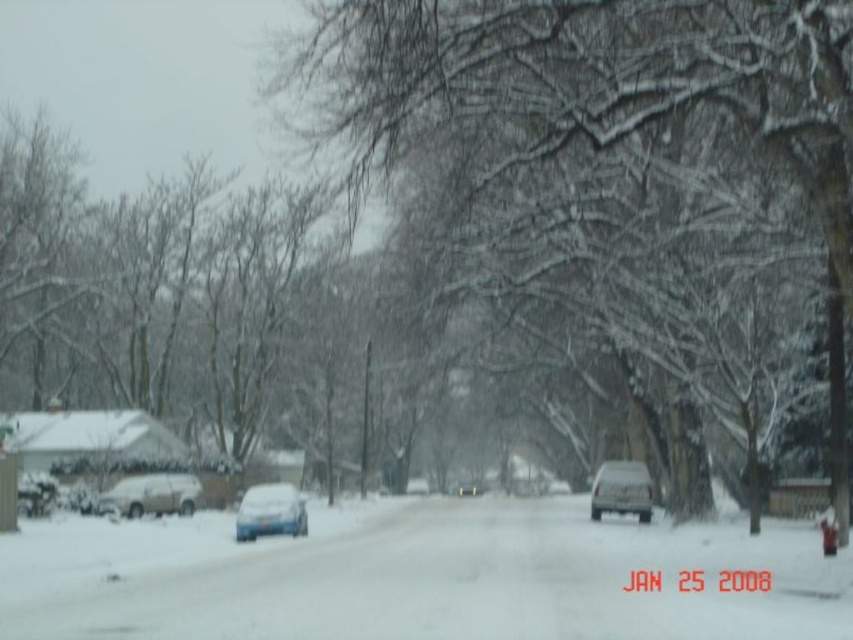
Between white matte suv at left and matte blue car at center, which one appears on the left side from the viewer's perspective?

white matte suv at left is more to the left.

Who is more forward, [170,508] or [262,506]?

Point [262,506] is more forward.

Identify the location of white matte suv at left. (151, 496).

Which is behind, point (469, 570) or point (590, 516)?

Positioned behind is point (590, 516).

Which of these two, white powdery snow at center or matte silver truck at center, stands shorter?

With less height is matte silver truck at center.

Locate an element on the screen. This screenshot has width=853, height=640. white powdery snow at center is located at coordinates (460, 582).

In the scene shown: Is snow-covered branches at center thinner than white powdery snow at center?

Yes.

Does point (381, 157) come in front of point (358, 531)?

Yes, it is.

Does point (654, 36) come in front of point (575, 547)?

Yes, point (654, 36) is closer to viewer.

This screenshot has height=640, width=853. I want to click on snow-covered branches at center, so click(x=585, y=83).